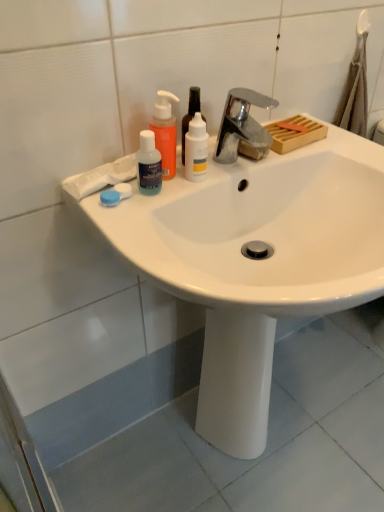
Identify the location of free region under white glossy sink at center (from a real-world perspective). The height and width of the screenshot is (512, 384). (268, 450).